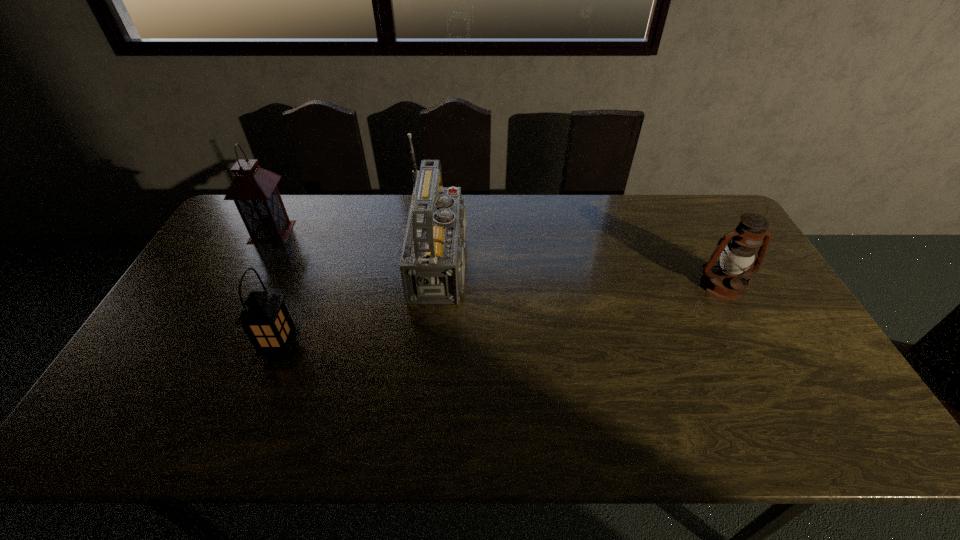
The height and width of the screenshot is (540, 960). In the image, there is a desktop. Identify the location of vacant area at the near right corner. (837, 421).

Where is `unoccupied position between the nearest lantern and the second farthest lantern`? The height and width of the screenshot is (540, 960). unoccupied position between the nearest lantern and the second farthest lantern is located at coordinates (502, 318).

Locate an element on the screen. This screenshot has height=540, width=960. vacant point located between the rightmost object and the second lantern from right to left is located at coordinates (502, 318).

Identify the location of vacant space in between the farthest lantern and the radio receiver. (360, 247).

The height and width of the screenshot is (540, 960). I want to click on free space between the rightmost object and the second object from right to left, so click(x=586, y=274).

Find the location of a particular element. The width and height of the screenshot is (960, 540). vacant point located between the farthest lantern and the second object from right to left is located at coordinates (360, 247).

Locate an element on the screen. The height and width of the screenshot is (540, 960). blank region between the farthest lantern and the second object from right to left is located at coordinates (360, 247).

You are a GUI agent. You are given a task and a screenshot of the screen. Output one action in this format:
    pyautogui.click(x=<x>, y=<y>)
    Task: Click on the free space between the second lantern from right to left and the rightmost lantern
    The image size is (960, 540).
    Given the screenshot: What is the action you would take?
    pyautogui.click(x=502, y=318)

Locate an element on the screen. free space between the rightmost lantern and the nearest lantern is located at coordinates (502, 318).

Locate an element on the screen. free space between the second farthest lantern and the farthest lantern is located at coordinates (497, 259).